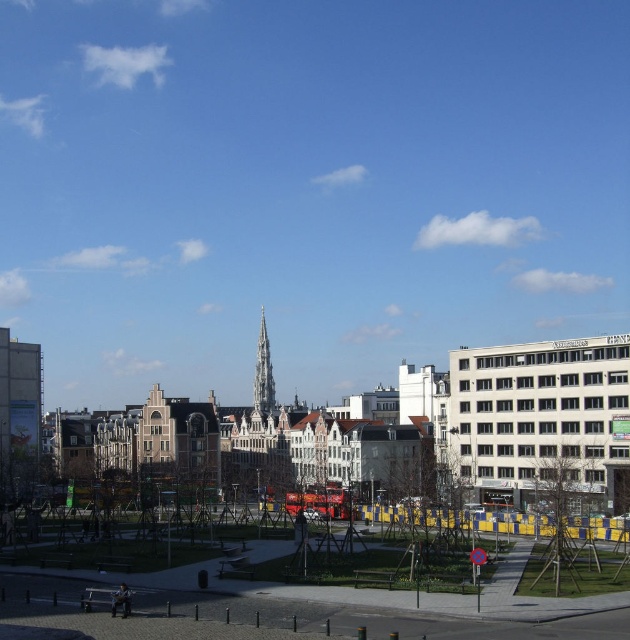
Question: Does green grass at center have a smaller size compared to blue glass spire at center?

Choices:
 (A) no
 (B) yes

Answer: (B)

Question: Is green grass at center smaller than blue glass spire at center?

Choices:
 (A) no
 (B) yes

Answer: (B)

Question: Is green grass at center positioned before blue glass spire at center?

Choices:
 (A) no
 (B) yes

Answer: (B)

Question: Which point is closer to the camera taking this photo?

Choices:
 (A) (72, 577)
 (B) (265, 387)

Answer: (A)